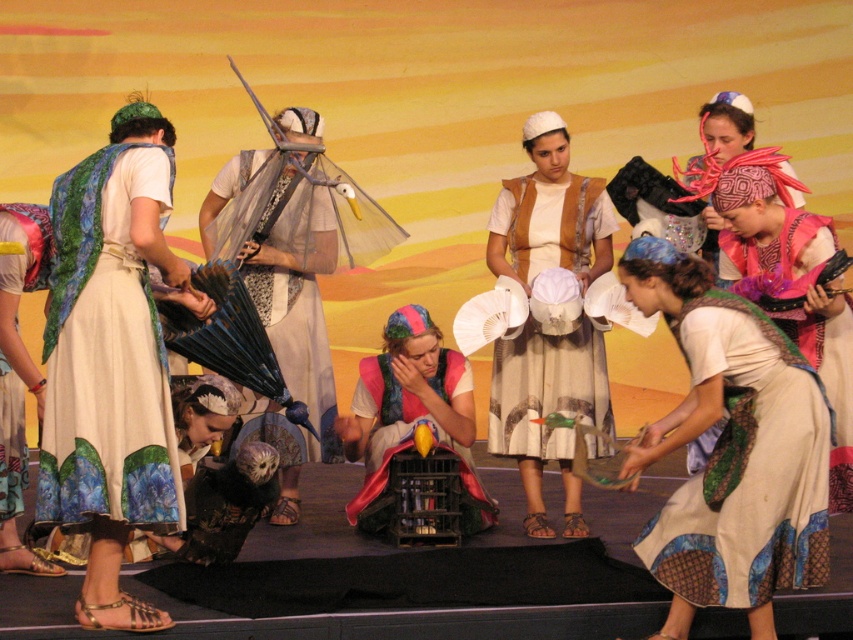
Is matte green scarf at center to the left of silky white robe at center from the viewer's perspective?

No, matte green scarf at center is not to the left of silky white robe at center.

Between matte green scarf at center and silky white robe at center, which one appears on the right side from the viewer's perspective?

Positioned to the right is matte green scarf at center.

Is point (659, 260) closer to camera compared to point (287, 378)?

That is True.

Image resolution: width=853 pixels, height=640 pixels. In order to click on matte green scarf at center in this screenshot , I will do `click(730, 449)`.

Who is higher up, textured green scarf at left or matte green scarf at center?

Positioned higher is textured green scarf at left.

Between textured green scarf at left and matte green scarf at center, which one has more height?

Standing taller between the two is textured green scarf at left.

Based on the photo, who is more forward, (47, 330) or (747, 538)?

Point (747, 538) is in front.

I want to click on textured green scarf at left, so click(111, 360).

This screenshot has height=640, width=853. Identify the location of matte green scarf at center. (730, 449).

Between point (798, 380) and point (543, 252), which one is positioned in front?

Point (798, 380)

Between point (764, 477) and point (587, 212), which one is positioned behind?

Point (587, 212)

Where is `matte green scarf at center`? matte green scarf at center is located at coordinates (730, 449).